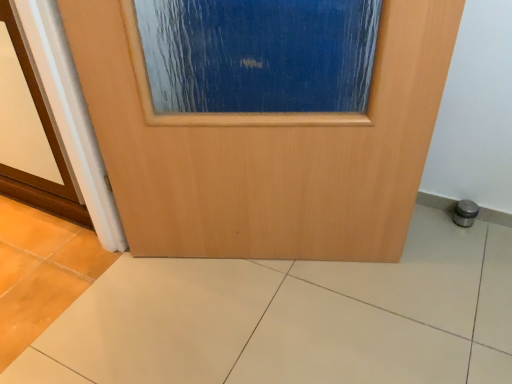
Question: Based on their sizes in the image, would you say wooden door at center is bigger or smaller than blue textured glass at center?

Choices:
 (A) small
 (B) big

Answer: (A)

Question: From a real-world perspective, relative to blue textured glass at center, is wooden door at center vertically above or below?

Choices:
 (A) above
 (B) below

Answer: (B)

Question: Which is nearer to the beige ceramic tile at center?

Choices:
 (A) wooden door at center
 (B) blue textured glass at center

Answer: (A)

Question: Estimate the real-world distances between objects in this image. Which object is farther from the wooden door at center?

Choices:
 (A) beige ceramic tile at center
 (B) blue textured glass at center

Answer: (A)